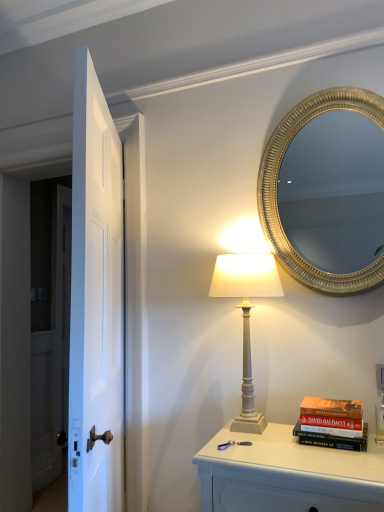
Question: Can you confirm if white painted wood nightstand at lower right is taller than gold textured mirror at upper right?

Choices:
 (A) yes
 (B) no

Answer: (B)

Question: Can you confirm if white painted wood nightstand at lower right is smaller than gold textured mirror at upper right?

Choices:
 (A) no
 (B) yes

Answer: (A)

Question: Is white painted wood nightstand at lower right thinner than gold textured mirror at upper right?

Choices:
 (A) yes
 (B) no

Answer: (B)

Question: Would you consider white painted wood nightstand at lower right to be distant from gold textured mirror at upper right?

Choices:
 (A) no
 (B) yes

Answer: (B)

Question: Is gold textured mirror at upper right located within white painted wood nightstand at lower right?

Choices:
 (A) yes
 (B) no

Answer: (B)

Question: Does white painted wood nightstand at lower right appear on the left side of gold textured mirror at upper right?

Choices:
 (A) yes
 (B) no

Answer: (A)

Question: Considering the relative positions of white matte table lamp at center and hardcover book at right in the image provided, is white matte table lamp at center to the left of hardcover book at right from the viewer's perspective?

Choices:
 (A) yes
 (B) no

Answer: (A)

Question: Does white matte table lamp at center have a lesser width compared to hardcover book at right?

Choices:
 (A) yes
 (B) no

Answer: (B)

Question: Does white matte table lamp at center come in front of hardcover book at right?

Choices:
 (A) no
 (B) yes

Answer: (A)

Question: Is white matte table lamp at center far from hardcover book at right?

Choices:
 (A) no
 (B) yes

Answer: (A)

Question: Considering the relative sizes of white matte table lamp at center and hardcover book at right in the image provided, is white matte table lamp at center shorter than hardcover book at right?

Choices:
 (A) no
 (B) yes

Answer: (A)

Question: Does white matte table lamp at center touch hardcover book at right?

Choices:
 (A) yes
 (B) no

Answer: (B)

Question: Considering the relative positions of white matte table lamp at center and white glossy door at left in the image provided, is white matte table lamp at center in front of white glossy door at left?

Choices:
 (A) no
 (B) yes

Answer: (A)